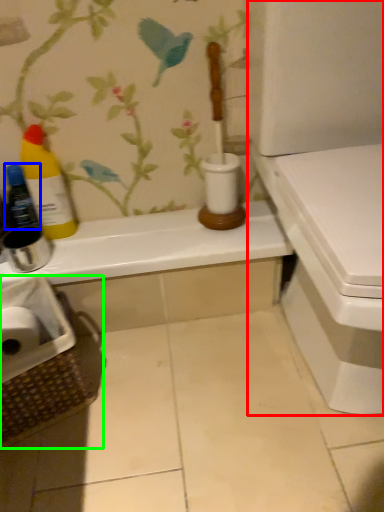
Question: Which is farther away from toilet (highlighted by a red box)? bottle (highlighted by a blue box) or laundry basket (highlighted by a green box)?

Choices:
 (A) bottle
 (B) laundry basket

Answer: (A)